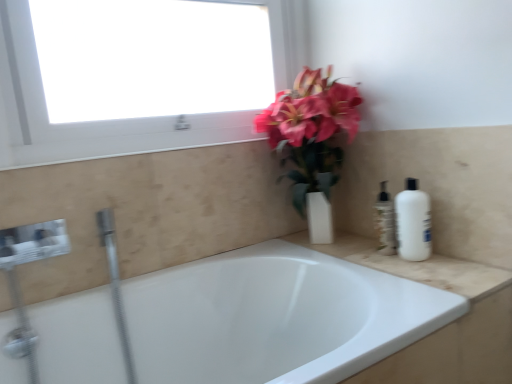
Image resolution: width=512 pixels, height=384 pixels. Find the location of `vacant region in front of translucent plastic soap dispenser at right`. vacant region in front of translucent plastic soap dispenser at right is located at coordinates (419, 266).